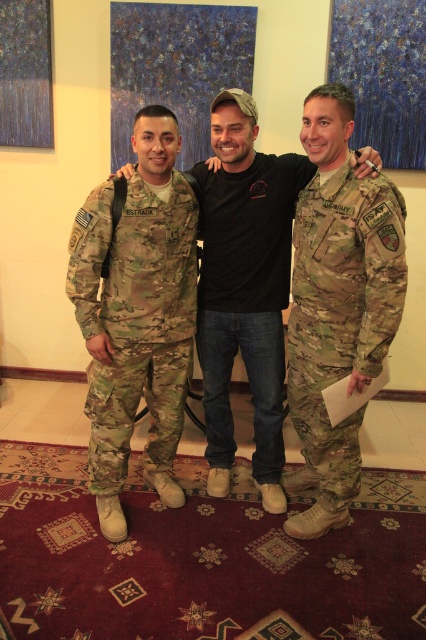
Does camouflage fabric uniform at left appear over camouflage uniform at center?

No, camouflage fabric uniform at left is not above camouflage uniform at center.

Does camouflage fabric uniform at left lie behind camouflage uniform at center?

No, it is in front of camouflage uniform at center.

Where is `camouflage fabric uniform at left`? This screenshot has height=640, width=426. camouflage fabric uniform at left is located at coordinates (135, 320).

In order to click on camouflage fabric uniform at left in this screenshot , I will do `click(135, 320)`.

How far apart are camouflage uniform at center and black cotton t-shirt at center?

A distance of 2.05 centimeters exists between camouflage uniform at center and black cotton t-shirt at center.

Who is more forward, (233, 340) or (273, 282)?

Positioned in front is point (273, 282).

Find the location of a particular element. Image resolution: width=426 pixels, height=640 pixels. camouflage uniform at center is located at coordinates (244, 276).

Does point (127, 305) come in front of point (321, 308)?

That is False.

Who is more distant from viewer, (x=144, y=289) or (x=359, y=474)?

The point (x=359, y=474) is behind.

You are a GUI agent. You are given a task and a screenshot of the screen. Output one action in this format:
    pyautogui.click(x=<x>, y=<y>)
    Task: Click on the camouflage fabric uniform at left
    
    Given the screenshot: What is the action you would take?
    pyautogui.click(x=135, y=320)